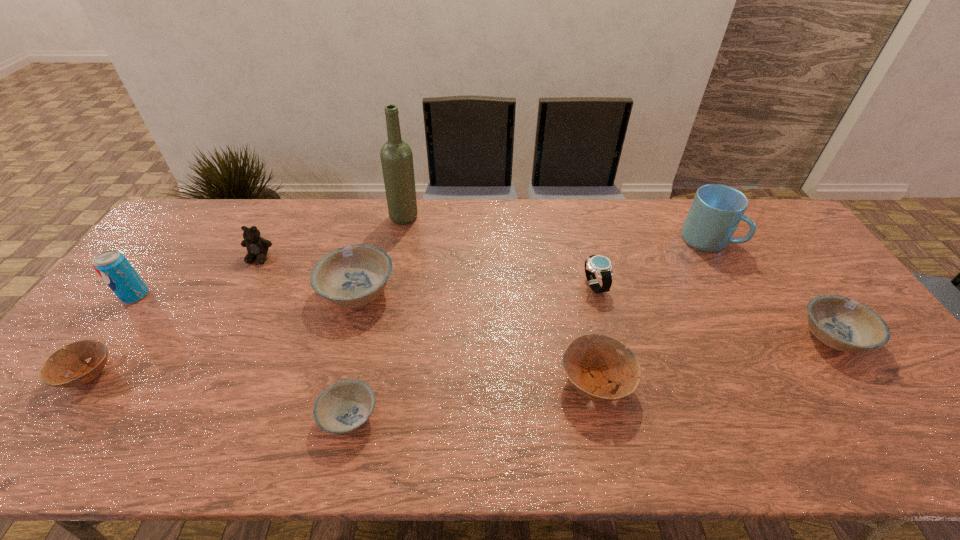
You are a GUI agent. You are given a task and a screenshot of the screen. Output one action in this format:
    pyautogui.click(x=<x>, y=<y>)
    Task: Click on the second biggest blue bowl
    
    Given the screenshot: What is the action you would take?
    pyautogui.click(x=841, y=323)

What are the coordinates of `the rightmost blue bowl` in the screenshot? It's located at pyautogui.click(x=841, y=323).

Locate an element on the screen. The image size is (960, 540). the smaller brown bowl is located at coordinates (53, 371).

What are the coordinates of `the leftmost bowl` in the screenshot? It's located at (53, 371).

Locate an element on the screen. The image size is (960, 540). the smallest blue bowl is located at coordinates (344, 407).

The width and height of the screenshot is (960, 540). I want to click on free space located on the right of the tallest object, so click(x=492, y=217).

The height and width of the screenshot is (540, 960). Find the location of `vacant space located on the front of the mug`. vacant space located on the front of the mug is located at coordinates (769, 353).

Locate an element on the screen. free region located 0.250m on the front of the soda can is located at coordinates (71, 381).

Image resolution: width=960 pixels, height=540 pixels. In order to click on vacant region located on the face of the brown teddy bear in this screenshot , I will do `click(243, 289)`.

The height and width of the screenshot is (540, 960). Find the location of `free space located on the front of the watch`. free space located on the front of the watch is located at coordinates (603, 322).